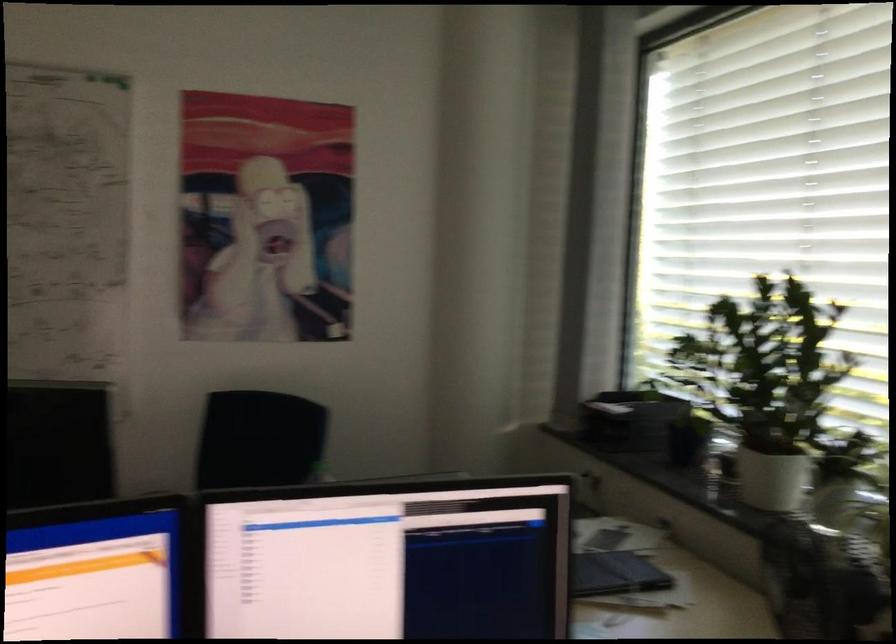
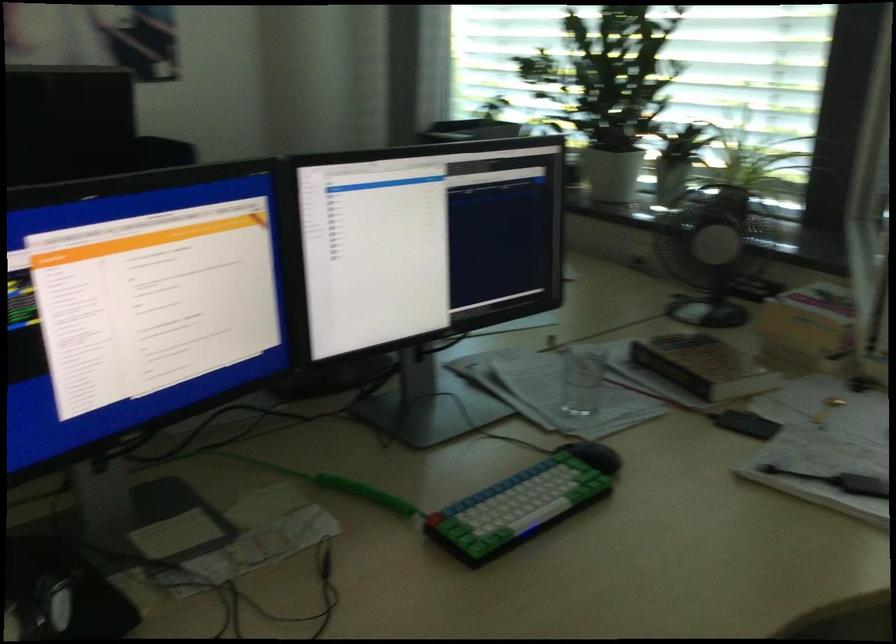
Where in the second image is the point corresponding to point 748,475 from the first image?

(612, 174)